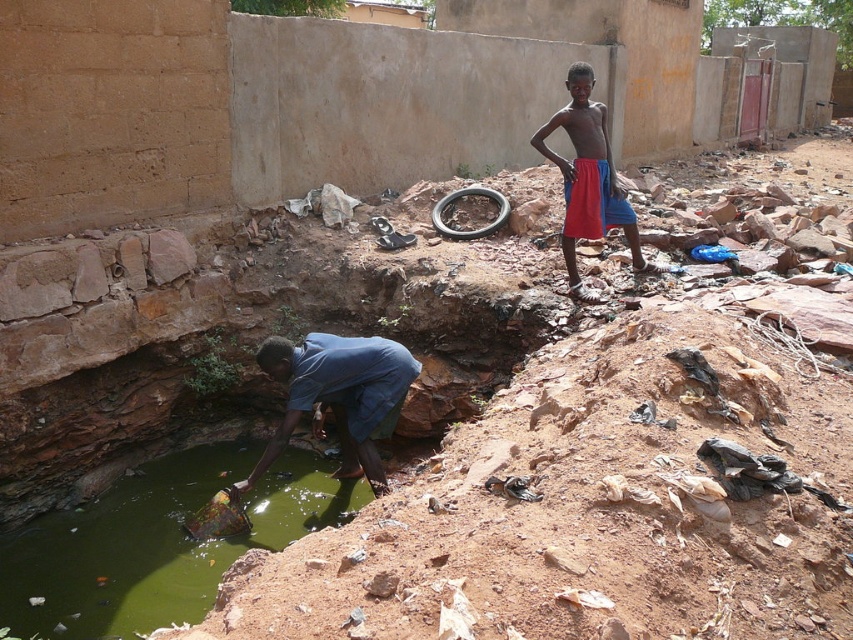
Question: Is green murky water at lower left to the left of red fabric shorts at upper right from the viewer's perspective?

Choices:
 (A) yes
 (B) no

Answer: (A)

Question: From the image, what is the correct spatial relationship of green murky water at lower left in relation to blue fabric at lower left?

Choices:
 (A) below
 (B) above

Answer: (A)

Question: Which of these objects is positioned farthest from the green murky water at lower left?

Choices:
 (A) black rubber tire at center
 (B) blue fabric at lower left

Answer: (A)

Question: Which object is farther from the camera taking this photo?

Choices:
 (A) blue fabric at lower left
 (B) green murky water at lower left
 (C) red fabric shorts at upper right

Answer: (C)

Question: Estimate the real-world distances between objects in this image. Which object is farther from the blue fabric at lower left?

Choices:
 (A) green murky water at lower left
 (B) black rubber tire at center

Answer: (B)

Question: Does red fabric shorts at upper right have a smaller size compared to black rubber tire at center?

Choices:
 (A) no
 (B) yes

Answer: (A)